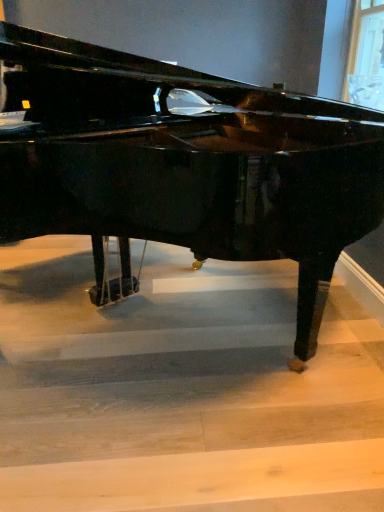
In order to click on free space underneath glossy black piano at center (from a real-world perspective) in this screenshot , I will do `click(155, 343)`.